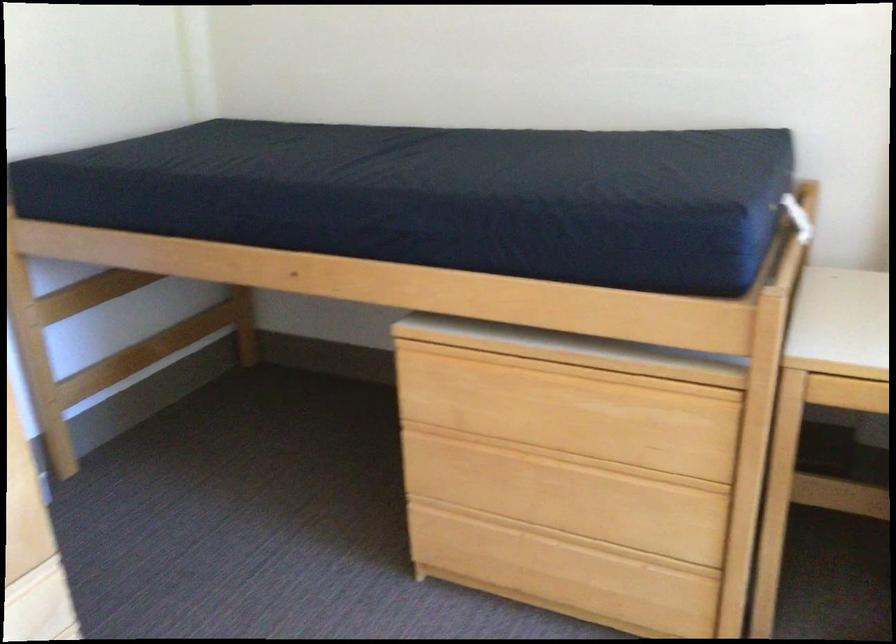
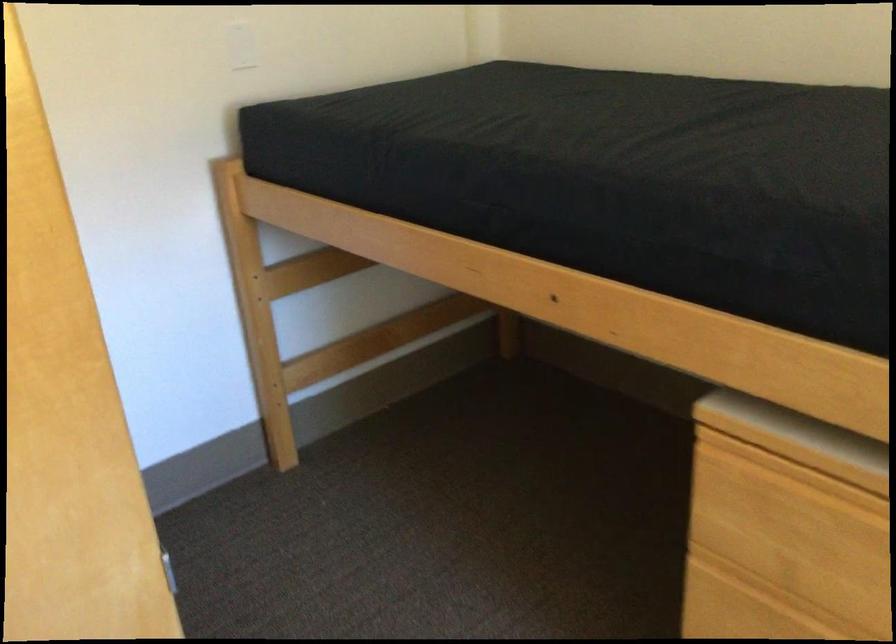
In the second image, find the point that corresponds to [73,303] in the first image.

(307, 270)